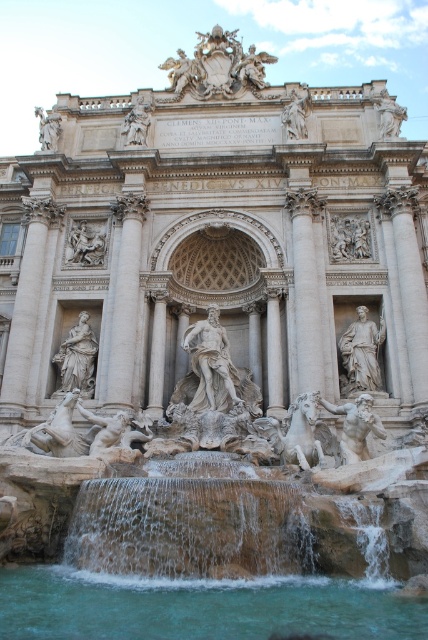
Question: Is polished marble statue at center behind matte stone statue at left?

Choices:
 (A) yes
 (B) no

Answer: (B)

Question: Which object is the farthest from the white marble statue at center?

Choices:
 (A) golden stone sculpture at upper center
 (B) polished marble statue at lower right
 (C) matte stone statue at left

Answer: (C)

Question: Among these points, which one is nearest to the camera?

Choices:
 (A) (291, 97)
 (B) (137, 573)

Answer: (B)

Question: Among these points, which one is farthest from the camera?

Choices:
 (A) (193, 401)
 (B) (58, 115)

Answer: (B)

Question: Where is smooth stone waterfall at lower center located in relation to white marble statue at right in the image?

Choices:
 (A) right
 (B) left

Answer: (B)

Question: Does white marble statue at right appear on the left side of matte stone statue at left?

Choices:
 (A) yes
 (B) no

Answer: (B)